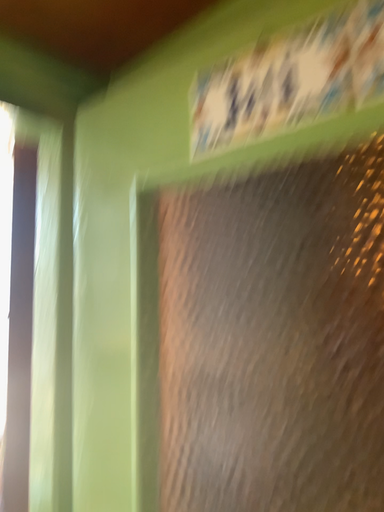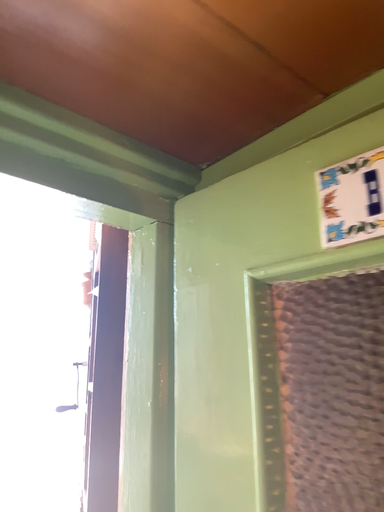
Question: Which way did the camera rotate in the video?

Choices:
 (A) rotated downward
 (B) rotated upward

Answer: (B)